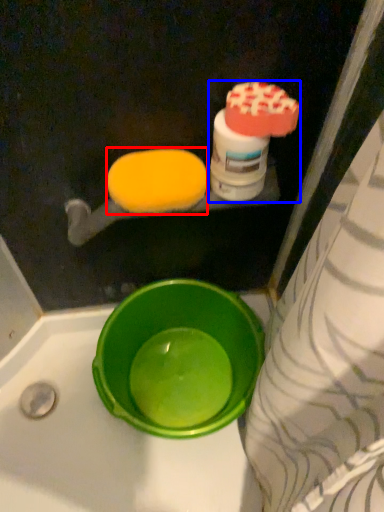
Question: Which of the following is the farthest to the observer, food (highlighted by a red box) or cleaning product (highlighted by a blue box)?

Choices:
 (A) food
 (B) cleaning product

Answer: (A)